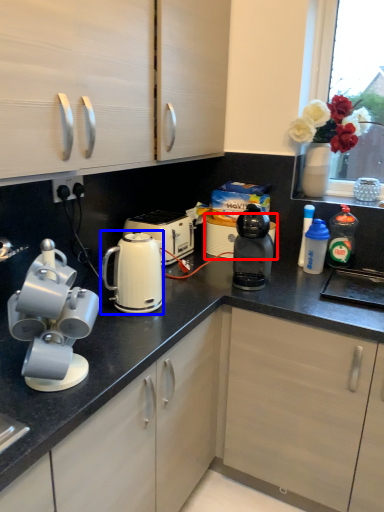
Question: Which point is closer to the camera, appliance (highlighted by a red box) or kitchen appliance (highlighted by a blue box)?

Choices:
 (A) appliance
 (B) kitchen appliance

Answer: (B)